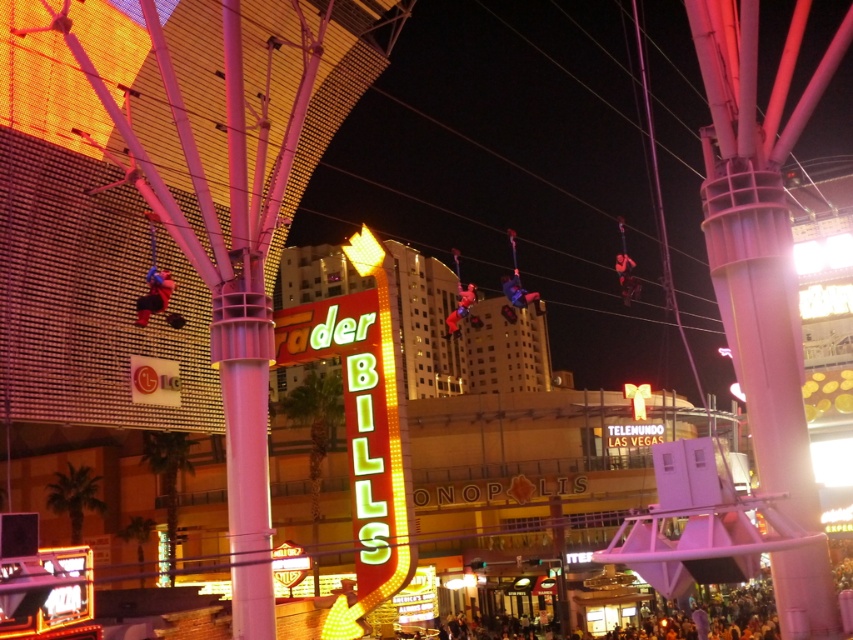
You are a photographer positioned in the middle of the street. You see a matte blue suit at left and a red fabric superhero at center. Which object is nearer to you?

The matte blue suit at left is closer to the viewer than the red fabric superhero at center.

You are standing in the casino area and want to take a photo of both the neon sign and the Telemundo Las Vegas sign. The neon sign is at point (622, 579) and the Telemundo Las Vegas sign is at point (627, 266). Since you can only focus on one point at a time, which point should you focus on to ensure both signs are in the frame?

You should focus on point (627, 266) because it is closer to the camera than point (622, 579). By focusing on the closer point, both signs will be in focus since the further point is behind it.